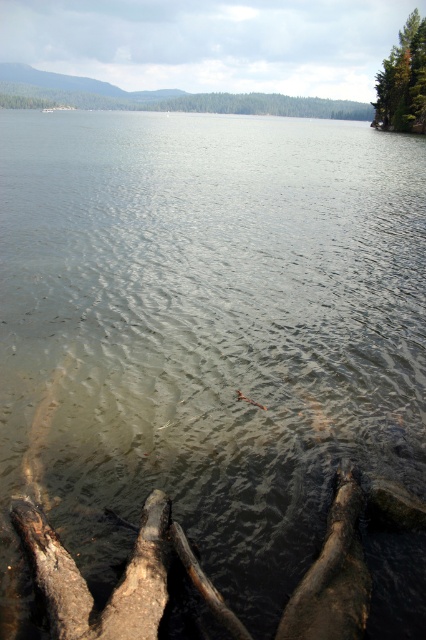
Question: Estimate the real-world distances between objects in this image. Which object is farther from the dark brown rough wood at lower left?

Choices:
 (A) green matte tree at upper right
 (B) dark brown wood log at lower center

Answer: (A)

Question: Is dark brown rough wood at lower left above dark brown wood log at lower center?

Choices:
 (A) no
 (B) yes

Answer: (B)

Question: Which point is closer to the camera?

Choices:
 (A) dark brown wood log at lower center
 (B) dark brown rough wood at lower left

Answer: (B)

Question: Can you confirm if dark brown wood log at lower center is positioned to the right of green matte tree at upper right?

Choices:
 (A) no
 (B) yes

Answer: (A)

Question: Is the position of dark brown wood log at lower center less distant than that of green matte tree at upper right?

Choices:
 (A) yes
 (B) no

Answer: (A)

Question: Which object is closer to the camera taking this photo?

Choices:
 (A) dark brown rough wood at lower left
 (B) green matte tree at upper right

Answer: (A)